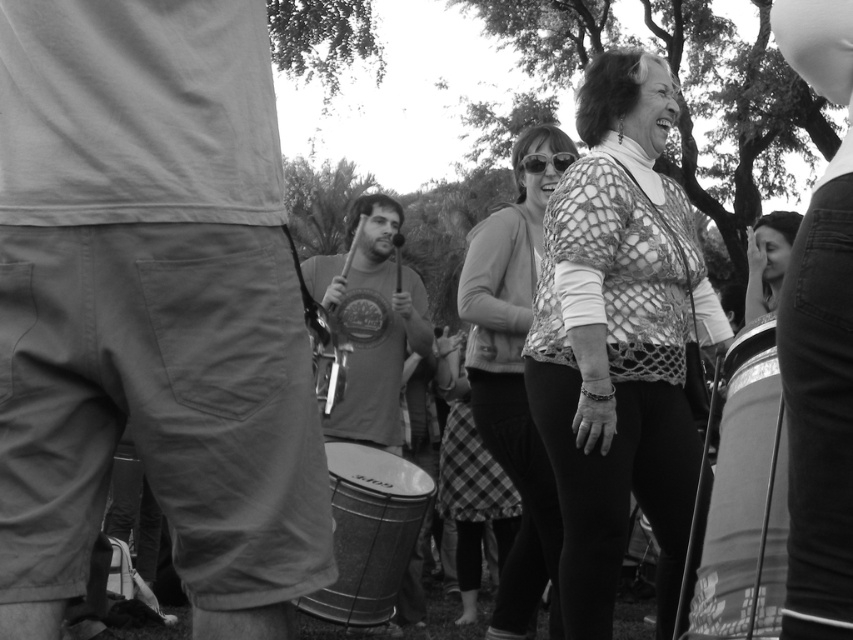
Question: Does netted fabric blouse at center appear on the right side of metallic drum at lower center?

Choices:
 (A) no
 (B) yes

Answer: (B)

Question: Among these points, which one is farthest from the camera?

Choices:
 (A) (213, 131)
 (B) (560, 518)

Answer: (B)

Question: Which point is farther from the camera taking this photo?

Choices:
 (A) (349, 324)
 (B) (520, 436)
 (C) (596, 536)
 (D) (74, 352)

Answer: (A)

Question: Does khaki cotton shorts at left appear under netted fabric blouse at center?

Choices:
 (A) no
 (B) yes

Answer: (A)

Question: Is khaki cotton shorts at left closer to camera compared to metallic drum at lower center?

Choices:
 (A) no
 (B) yes

Answer: (B)

Question: Which point is closer to the camera?

Choices:
 (A) (32, 212)
 (B) (403, 611)

Answer: (A)